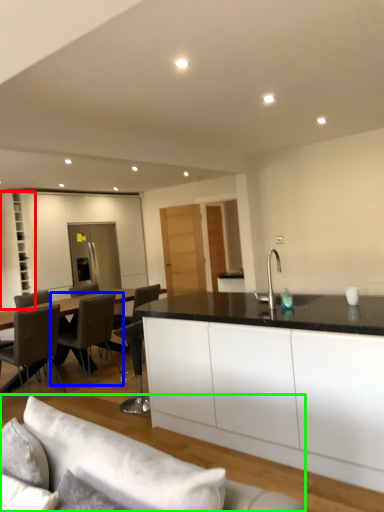
Question: Which object is the farthest from cabinetry (highlighted by a red box)? Choose among these: chair (highlighted by a blue box) or studio couch (highlighted by a green box).

Choices:
 (A) chair
 (B) studio couch

Answer: (B)